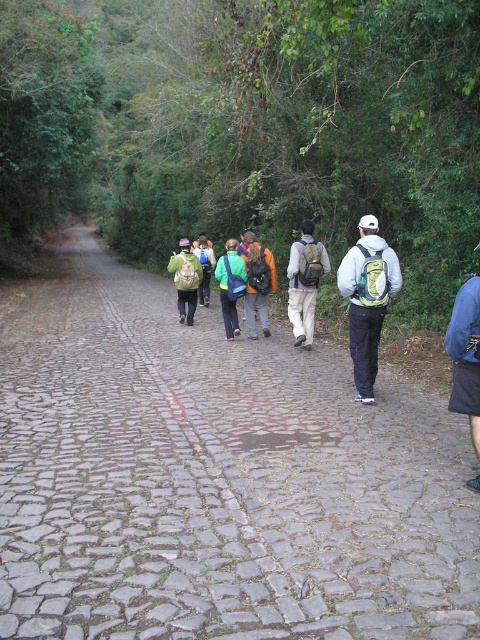
Question: Is matte gray backpack at center bigger than teal fabric backpack at center?

Choices:
 (A) no
 (B) yes

Answer: (B)

Question: Does cobblestone path at center appear over teal fabric backpack at center?

Choices:
 (A) yes
 (B) no

Answer: (B)

Question: Is matte green backpack at center above orange fabric backpack at center?

Choices:
 (A) no
 (B) yes

Answer: (A)

Question: Which point is closer to the camera taking this photo?

Choices:
 (A) (296, 305)
 (B) (337, 273)

Answer: (B)

Question: Considering the real-world distances, which object is closest to the matte green backpack at center?

Choices:
 (A) cobblestone path at center
 (B) teal fabric backpack at center
 (C) green matte backpack at center

Answer: (A)

Question: Among these points, which one is nearest to the camera?

Choices:
 (A) (300, 326)
 (B) (261, 273)

Answer: (A)